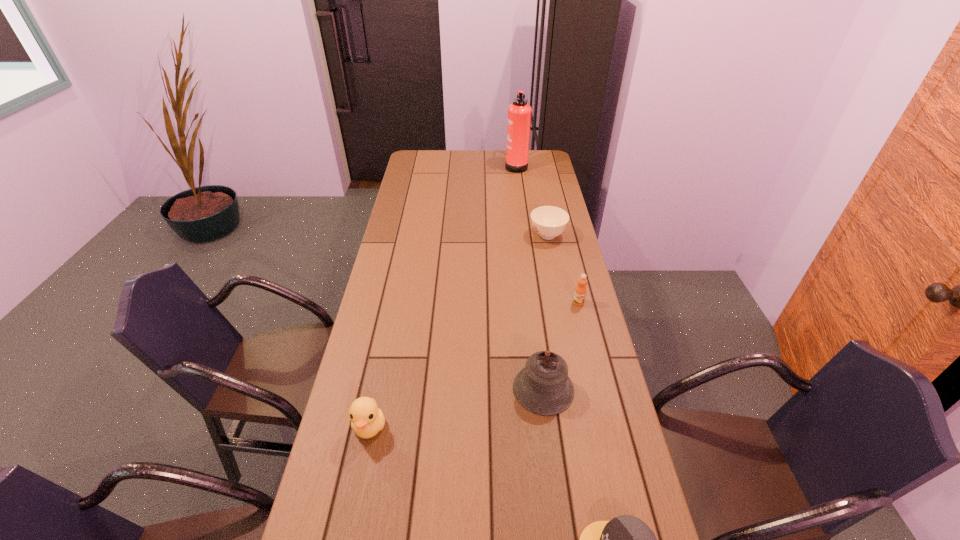
Identify the location of vacant space situated on the back of the bell. This screenshot has width=960, height=540. (530, 282).

At what (x,y) coordinates should I click in order to perform the action: click on free space located 0.130m on the front label of the orange juice. Please return your answer as a coordinate pair (x, y). Image resolution: width=960 pixels, height=540 pixels. Looking at the image, I should click on (587, 335).

The height and width of the screenshot is (540, 960). I want to click on vacant region located on the face of the leftmost object, so click(x=349, y=523).

This screenshot has width=960, height=540. Identify the location of free space located on the front of the sugar bowl. (561, 301).

The width and height of the screenshot is (960, 540). Identify the location of object located at the far edge. (519, 113).

Find the location of a particular element. This screenshot has height=540, width=960. object that is at the left edge is located at coordinates (367, 419).

At what (x,y) coordinates should I click in order to perform the action: click on fire extinguisher that is at the right edge. Please return your answer as a coordinate pair (x, y). This screenshot has height=540, width=960. Looking at the image, I should click on (519, 113).

The image size is (960, 540). In order to click on bell that is at the right edge in this screenshot , I will do pos(543,387).

The height and width of the screenshot is (540, 960). I want to click on orange juice that is at the right edge, so click(x=580, y=291).

Find the location of a particular element. The height and width of the screenshot is (540, 960). sugar bowl that is at the right edge is located at coordinates (548, 222).